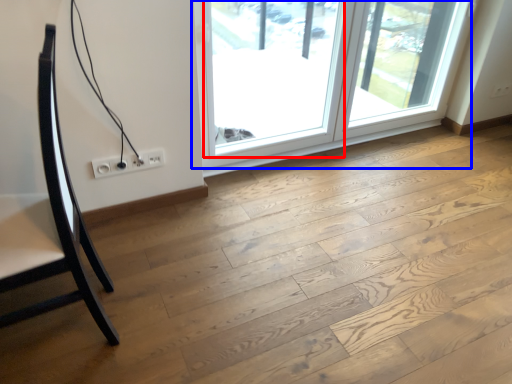
Question: Among these objects, which one is nearest to the camera, window (highlighted by a red box) or window (highlighted by a blue box)?

Choices:
 (A) window
 (B) window

Answer: (A)